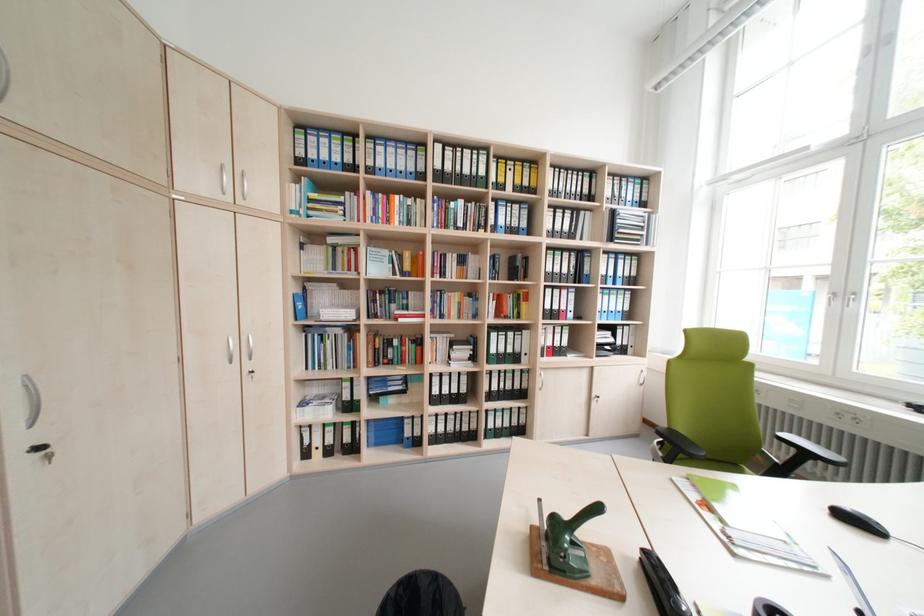
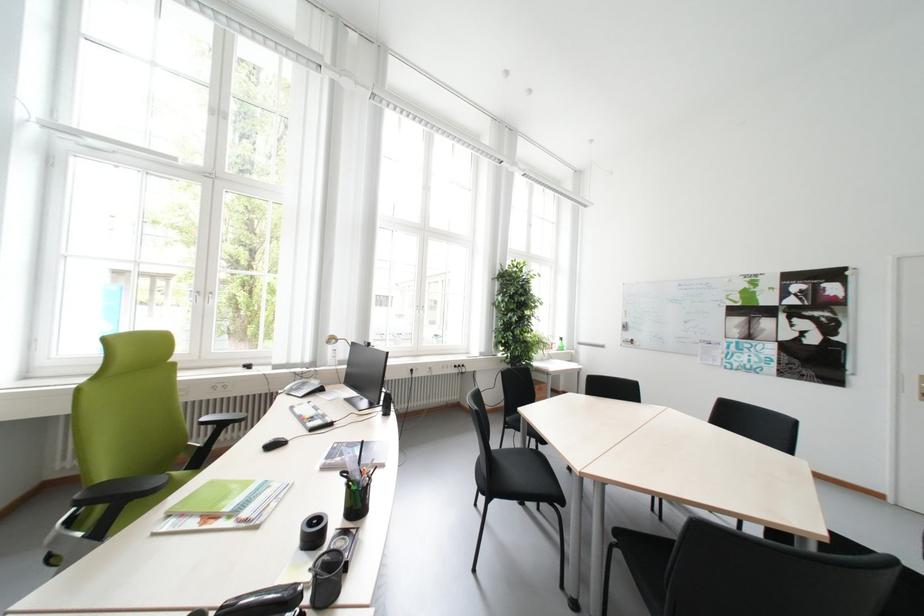
Where in the second image is the point corresponding to the point at 682,432 from the first image?

(104, 488)